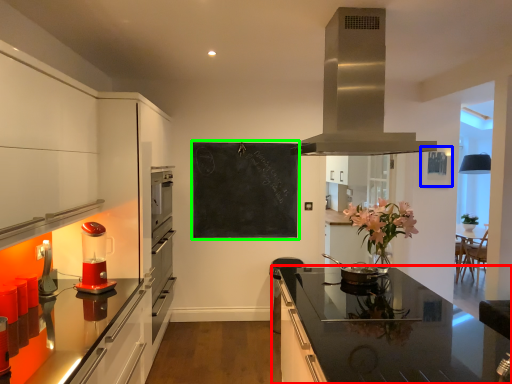
Question: Which object is the farthest from countertop (highlighted by a red box)? Choose among these: picture frame (highlighted by a blue box) or bulletin board (highlighted by a green box).

Choices:
 (A) picture frame
 (B) bulletin board

Answer: (A)